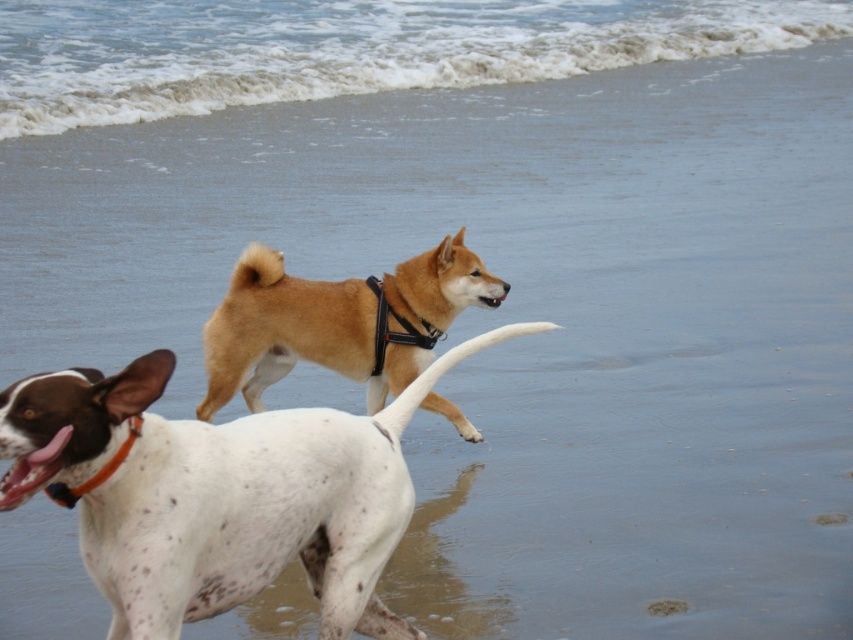
You are standing at the edge of the beach and see the white speckled fur at center and the orange nylon collar at lower left. Which object is closer to your position?

The white speckled fur at center is to the right of the orange nylon collar at lower left, so the orange nylon collar at lower left is closer to your position.

You are standing at the center of the beach and want to find the white speckled fur at center. According to the coordinates provided, in which direction should you look relative to your position?

The white speckled fur at center is located at coordinates point [219,493]. Since the x coordinate is 0.772, which is greater than 0.5, it is to the right side of the center. The y coordinate is 0.259, which is below 0.5, so it is lower than the center. Therefore, you should look to the right and downward from your position at the center of the beach.